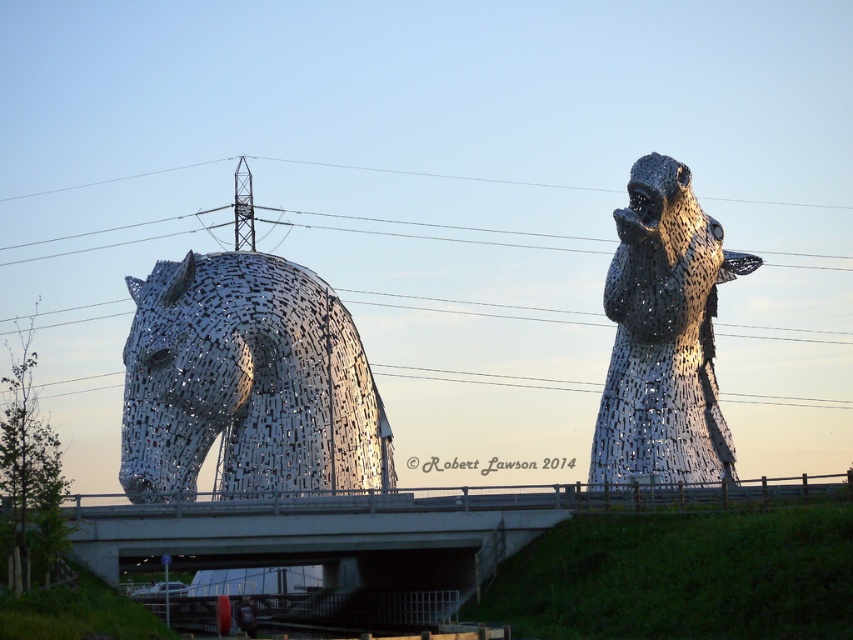
Question: Does metallic horse at left lie in front of metallic mosaic horse at right?

Choices:
 (A) yes
 (B) no

Answer: (A)

Question: Does metallic horse at left come behind metallic mosaic horse at right?

Choices:
 (A) no
 (B) yes

Answer: (A)

Question: Which of the following is the farthest from the observer?

Choices:
 (A) (125, 480)
 (B) (714, 480)
 (C) (312, 214)
 (D) (73, 538)

Answer: (C)

Question: Does concrete bridge at center appear under metallic mosaic horse at right?

Choices:
 (A) no
 (B) yes

Answer: (B)

Question: Which object appears farthest from the camera in this image?

Choices:
 (A) metallic mosaic horse at right
 (B) metallic wire at upper center
 (C) metallic horse at left

Answer: (B)

Question: Estimate the real-world distances between objects in this image. Which object is farther from the metallic wire at upper center?

Choices:
 (A) metallic mosaic horse at right
 (B) metallic horse at left
 (C) concrete bridge at center

Answer: (C)